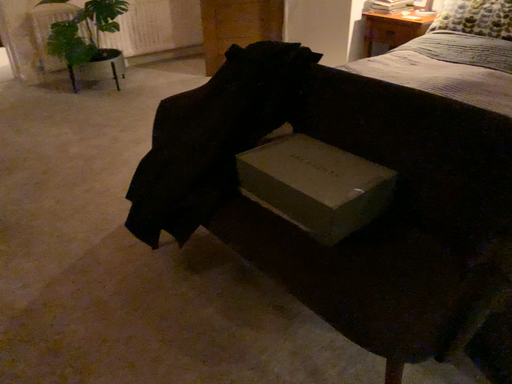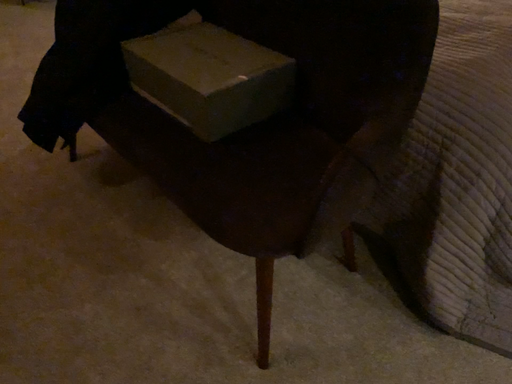
Question: How did the camera likely rotate when shooting the video?

Choices:
 (A) rotated downward
 (B) rotated upward

Answer: (A)